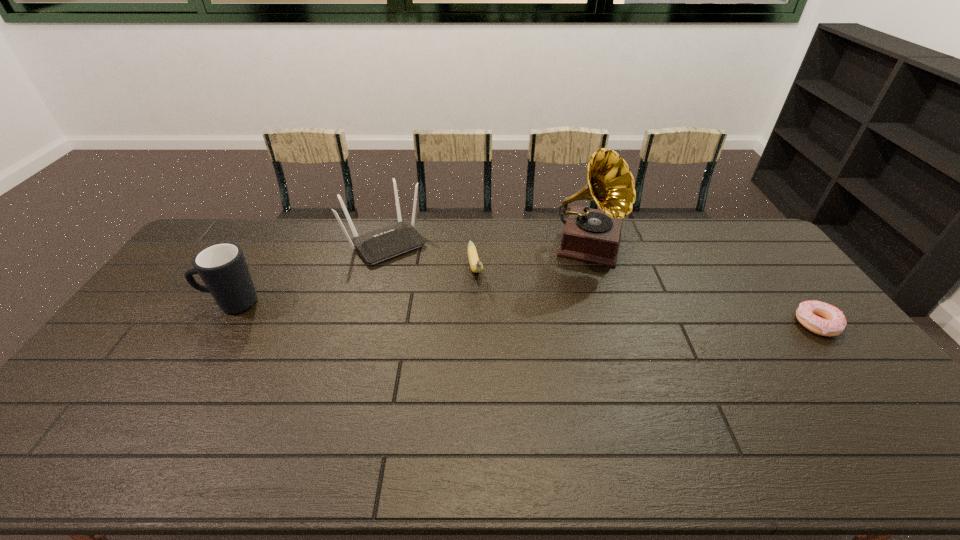
I want to click on vacant area situated 0.200m at the stem of the third object from right to left, so click(x=489, y=332).

The image size is (960, 540). What are the coordinates of `vacant space situated 0.290m at the stem of the third object from right to left` in the screenshot? It's located at (495, 355).

Where is `vacant space positioned on the front-facing side of the second object from left to right`? This screenshot has height=540, width=960. vacant space positioned on the front-facing side of the second object from left to right is located at coordinates (449, 316).

You are a GUI agent. You are given a task and a screenshot of the screen. Output one action in this format:
    pyautogui.click(x=<x>, y=<y>)
    Task: Click on the vacant area situated 0.290m on the front-facing side of the second object from left to right
    The width and height of the screenshot is (960, 540).
    Given the screenshot: What is the action you would take?
    point(446,313)

Locate an element on the screen. The width and height of the screenshot is (960, 540). vacant point located on the front-facing side of the second object from left to right is located at coordinates (421, 284).

Where is `blank space located from the horn of the phonograph record`? blank space located from the horn of the phonograph record is located at coordinates (579, 303).

Where is `free location located from the horn of the phonograph record`? Image resolution: width=960 pixels, height=540 pixels. free location located from the horn of the phonograph record is located at coordinates (564, 364).

Identify the location of vacant space situated from the horn of the phonograph record. The height and width of the screenshot is (540, 960). (564, 364).

Where is `banana at the far edge`? banana at the far edge is located at coordinates (476, 265).

Identify the location of router present at the far edge. (376, 246).